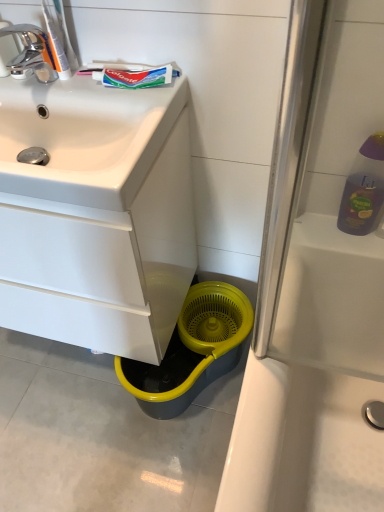
Measure the distance between white glossy sink at upper left and camera.

The distance of white glossy sink at upper left from camera is 27.32 inches.

At what (x,y) coordinates should I click in order to perform the action: click on white glossy cabinet at lower left. Please return your answer as a coordinate pair (x, y). Looking at the image, I should click on (103, 262).

Where is `colgate toothpaste at upper left, arranged as the second toothpaste when viewed from the left`? colgate toothpaste at upper left, arranged as the second toothpaste when viewed from the left is located at coordinates (135, 77).

Would you say white glossy sink at upper left is part of white matte toothpaste at upper left, the second toothpaste viewed from the right,'s contents?

No, white matte toothpaste at upper left, the second toothpaste viewed from the right, does not contain white glossy sink at upper left.

Is white matte toothpaste at upper left, the first toothpaste in the left-to-right sequence, oriented towards white glossy sink at upper left?

No, white matte toothpaste at upper left, the first toothpaste in the left-to-right sequence, is not facing towards white glossy sink at upper left.

From the image's perspective, which is below, white matte toothpaste at upper left, the second toothpaste viewed from the right, or white glossy sink at upper left?

white glossy sink at upper left appears lower in the image.

Considering the points (51, 47) and (48, 179), which point is in front, point (51, 47) or point (48, 179)?

Point (48, 179)

Is white glossy cabinet at lower left far from white glossy sink at upper left?

No, white glossy cabinet at lower left is in close proximity to white glossy sink at upper left.

The width and height of the screenshot is (384, 512). In order to click on bathroom cabinet located behind the white glossy sink at upper left in this screenshot , I will do `click(103, 262)`.

Does white glossy cabinet at lower left have a greater width compared to white glossy sink at upper left?

No.

From the image's perspective, is white glossy cabinet at lower left below white glossy sink at upper left?

Correct, white glossy cabinet at lower left appears lower than white glossy sink at upper left in the image.

Considering the sizes of objects white glossy sink at upper left and chrome/metallic faucet at upper left in the image provided, who is taller, white glossy sink at upper left or chrome/metallic faucet at upper left?

white glossy sink at upper left is taller.

From the picture: From a real-world perspective, is white glossy sink at upper left positioned over chrome/metallic faucet at upper left based on gravity?

No.

In the scene shown: How many degrees apart are the facing directions of white glossy sink at upper left and chrome/metallic faucet at upper left?

The angle between the facing direction of white glossy sink at upper left and the facing direction of chrome/metallic faucet at upper left is 4.7 degrees.

Between white glossy sink at upper left and chrome/metallic faucet at upper left, which one is positioned in front?

Positioned in front is white glossy sink at upper left.

Is colgate toothpaste at upper left, which is counted as the 1th toothpaste, starting from the right, turned away from chrome/metallic faucet at upper left?

colgate toothpaste at upper left, which is counted as the 1th toothpaste, starting from the right, is not turned away from chrome/metallic faucet at upper left.

How many degrees apart are the facing directions of colgate toothpaste at upper left, arranged as the second toothpaste when viewed from the left, and chrome/metallic faucet at upper left?

There is a 4.12-degree angle between the facing directions of colgate toothpaste at upper left, arranged as the second toothpaste when viewed from the left, and chrome/metallic faucet at upper left.

From a real-world perspective, which object rests below the other?

colgate toothpaste at upper left, which is counted as the 1th toothpaste, starting from the right, is physically lower.

Based on the photo, is colgate toothpaste at upper left, arranged as the second toothpaste when viewed from the left, at the left side of chrome/metallic faucet at upper left?

No.

In order to click on the 1st toothpaste above the white glossy cabinet at lower left (from a real-world perspective) in this screenshot , I will do `click(135, 77)`.

Which of these two, white glossy cabinet at lower left or colgate toothpaste at upper left, arranged as the second toothpaste when viewed from the left, stands shorter?

colgate toothpaste at upper left, arranged as the second toothpaste when viewed from the left, is shorter.

Is white glossy cabinet at lower left wider or thinner than colgate toothpaste at upper left, arranged as the second toothpaste when viewed from the left?

Considering their sizes, white glossy cabinet at lower left looks broader than colgate toothpaste at upper left, arranged as the second toothpaste when viewed from the left.

Would you say white glossy cabinet at lower left is outside colgate toothpaste at upper left, arranged as the second toothpaste when viewed from the left?

white glossy cabinet at lower left lies outside colgate toothpaste at upper left, arranged as the second toothpaste when viewed from the left,'s area.

Can you confirm if white glossy sink at upper left is smaller than white matte toothpaste at upper left, the first toothpaste in the left-to-right sequence?

Actually, white glossy sink at upper left might be larger than white matte toothpaste at upper left, the first toothpaste in the left-to-right sequence.

Considering the positions of points (90, 94) and (47, 6), is point (90, 94) closer to camera compared to point (47, 6)?

No, (90, 94) is behind (47, 6).

Who is smaller, chrome/metallic faucet at upper left or colgate toothpaste at upper left, which is counted as the 1th toothpaste, starting from the right?

With smaller size is colgate toothpaste at upper left, which is counted as the 1th toothpaste, starting from the right.

Considering the positions of objects chrome/metallic faucet at upper left and colgate toothpaste at upper left, which is counted as the 1th toothpaste, starting from the right, in the image provided, who is behind, chrome/metallic faucet at upper left or colgate toothpaste at upper left, which is counted as the 1th toothpaste, starting from the right,?

colgate toothpaste at upper left, which is counted as the 1th toothpaste, starting from the right, is behind.

Which of these two, chrome/metallic faucet at upper left or colgate toothpaste at upper left, arranged as the second toothpaste when viewed from the left, stands taller?

Standing taller between the two is chrome/metallic faucet at upper left.

This screenshot has width=384, height=512. In order to click on sink on the left of the white matte toothpaste at upper left, the first toothpaste in the left-to-right sequence in this screenshot , I will do `click(85, 138)`.

I want to click on sink lying above the white glossy cabinet at lower left (from the image's perspective), so click(x=85, y=138).

Which object lies further to the anchor point white matte toothpaste at upper left, the second toothpaste viewed from the right, chrome/metallic faucet at upper left or white glossy cabinet at lower left?

The object further to white matte toothpaste at upper left, the second toothpaste viewed from the right, is white glossy cabinet at lower left.

Looking at the image, which one is located further to white matte toothpaste at upper left, the second toothpaste viewed from the right, white glossy sink at upper left or chrome/metallic faucet at upper left?

Among the two, white glossy sink at upper left is located further to white matte toothpaste at upper left, the second toothpaste viewed from the right.

Considering their positions, is white matte toothpaste at upper left, the first toothpaste in the left-to-right sequence, positioned closer to colgate toothpaste at upper left, which is counted as the 1th toothpaste, starting from the right, than white glossy cabinet at lower left?

The object closer to colgate toothpaste at upper left, which is counted as the 1th toothpaste, starting from the right, is white matte toothpaste at upper left, the first toothpaste in the left-to-right sequence.

When comparing their distances from white matte toothpaste at upper left, the second toothpaste viewed from the right, does colgate toothpaste at upper left, arranged as the second toothpaste when viewed from the left, or white glossy sink at upper left seem further?

white glossy sink at upper left is positioned further to the anchor white matte toothpaste at upper left, the second toothpaste viewed from the right.

When comparing their distances from white glossy sink at upper left, does white glossy cabinet at lower left or white matte toothpaste at upper left, the second toothpaste viewed from the right, seem closer?

Among the two, white glossy cabinet at lower left is located nearer to white glossy sink at upper left.

When comparing their distances from white glossy cabinet at lower left, does colgate toothpaste at upper left, which is counted as the 1th toothpaste, starting from the right, or white matte toothpaste at upper left, the second toothpaste viewed from the right, seem closer?

colgate toothpaste at upper left, which is counted as the 1th toothpaste, starting from the right, is closer to white glossy cabinet at lower left.

Estimate the real-world distances between objects in this image. Which object is further from white glossy sink at upper left, white matte toothpaste at upper left, the second toothpaste viewed from the right, or chrome/metallic faucet at upper left?

white matte toothpaste at upper left, the second toothpaste viewed from the right, lies further to white glossy sink at upper left than the other object.

Looking at the image, which one is located closer to chrome/metallic faucet at upper left, white glossy cabinet at lower left or white matte toothpaste at upper left, the first toothpaste in the left-to-right sequence?

The object closer to chrome/metallic faucet at upper left is white matte toothpaste at upper left, the first toothpaste in the left-to-right sequence.

The height and width of the screenshot is (512, 384). I want to click on toothpaste between chrome/metallic faucet at upper left and white glossy cabinet at lower left from top to bottom, so click(x=135, y=77).

Find the location of `toothpaste between white matte toothpaste at upper left, the second toothpaste viewed from the right, and white glossy cabinet at lower left from top to bottom`. toothpaste between white matte toothpaste at upper left, the second toothpaste viewed from the right, and white glossy cabinet at lower left from top to bottom is located at coordinates (135, 77).

Identify the location of tap that lies between white matte toothpaste at upper left, the second toothpaste viewed from the right, and white glossy cabinet at lower left from top to bottom. Image resolution: width=384 pixels, height=512 pixels. (32, 53).

Locate an element on the screen. The width and height of the screenshot is (384, 512). toothpaste between chrome/metallic faucet at upper left and colgate toothpaste at upper left, arranged as the second toothpaste when viewed from the left, from left to right is located at coordinates (56, 41).